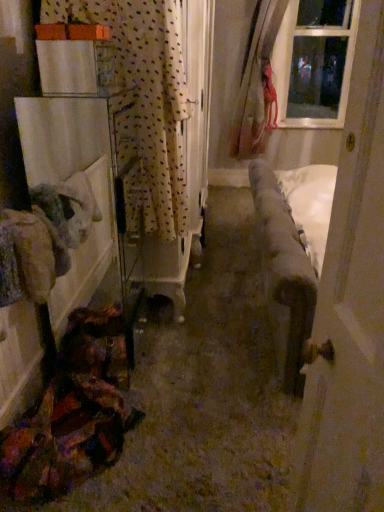
Question: Considering the relative sizes of white polka dot fabric at left and velvet fabric couch at center in the image provided, is white polka dot fabric at left taller than velvet fabric couch at center?

Choices:
 (A) yes
 (B) no

Answer: (A)

Question: Does white polka dot fabric at left appear on the left side of velvet fabric couch at center?

Choices:
 (A) no
 (B) yes

Answer: (B)

Question: From the image's perspective, does white polka dot fabric at left appear higher than velvet fabric couch at center?

Choices:
 (A) no
 (B) yes

Answer: (B)

Question: Is white polka dot fabric at left bigger than velvet fabric couch at center?

Choices:
 (A) yes
 (B) no

Answer: (B)

Question: From the image's perspective, is white polka dot fabric at left under velvet fabric couch at center?

Choices:
 (A) yes
 (B) no

Answer: (B)

Question: From the image's perspective, relative to wooden door at right, is velvet fabric couch at center above or below?

Choices:
 (A) below
 (B) above

Answer: (B)

Question: From a real-world perspective, is velvet fabric couch at center above or below wooden door at right?

Choices:
 (A) below
 (B) above

Answer: (A)

Question: Considering their positions, is velvet fabric couch at center located in front of or behind wooden door at right?

Choices:
 (A) behind
 (B) front

Answer: (A)

Question: Considering the positions of velvet fabric couch at center and wooden door at right in the image, is velvet fabric couch at center bigger or smaller than wooden door at right?

Choices:
 (A) small
 (B) big

Answer: (B)

Question: Is point (148, 180) closer or farther from the camera than point (362, 320)?

Choices:
 (A) closer
 (B) farther

Answer: (B)

Question: From the image's perspective, relative to wooden door at right, is white polka dot fabric at left above or below?

Choices:
 (A) below
 (B) above

Answer: (B)

Question: In terms of width, does white polka dot fabric at left look wider or thinner when compared to wooden door at right?

Choices:
 (A) thin
 (B) wide

Answer: (B)

Question: Is white polka dot fabric at left in front of or behind wooden door at right in the image?

Choices:
 (A) behind
 (B) front

Answer: (A)

Question: Is clear glass window at upper right taller or shorter than velvet fabric couch at center?

Choices:
 (A) short
 (B) tall

Answer: (B)

Question: Is point (319, 42) closer or farther from the camera than point (228, 224)?

Choices:
 (A) closer
 (B) farther

Answer: (B)